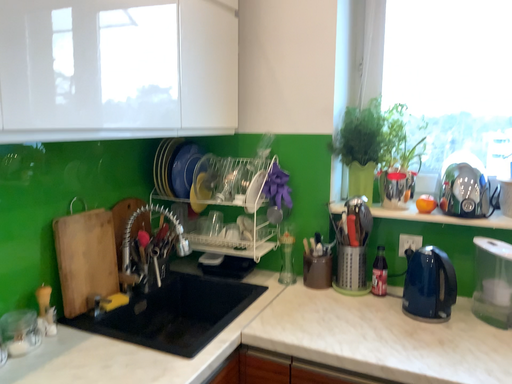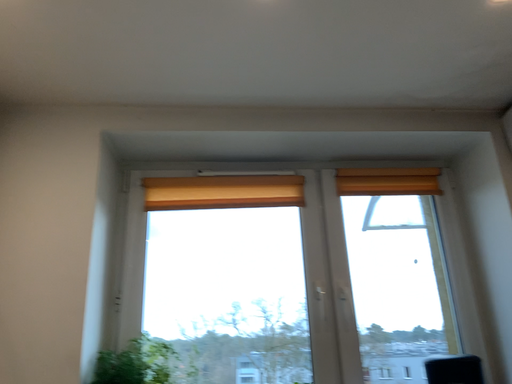
Question: How did the camera likely rotate when shooting the video?

Choices:
 (A) rotated upward
 (B) rotated downward

Answer: (A)